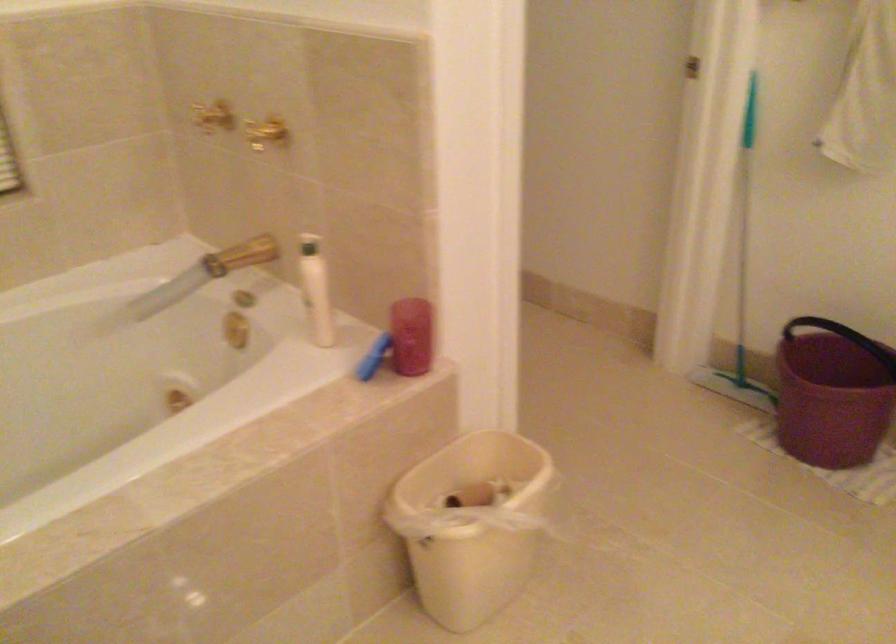
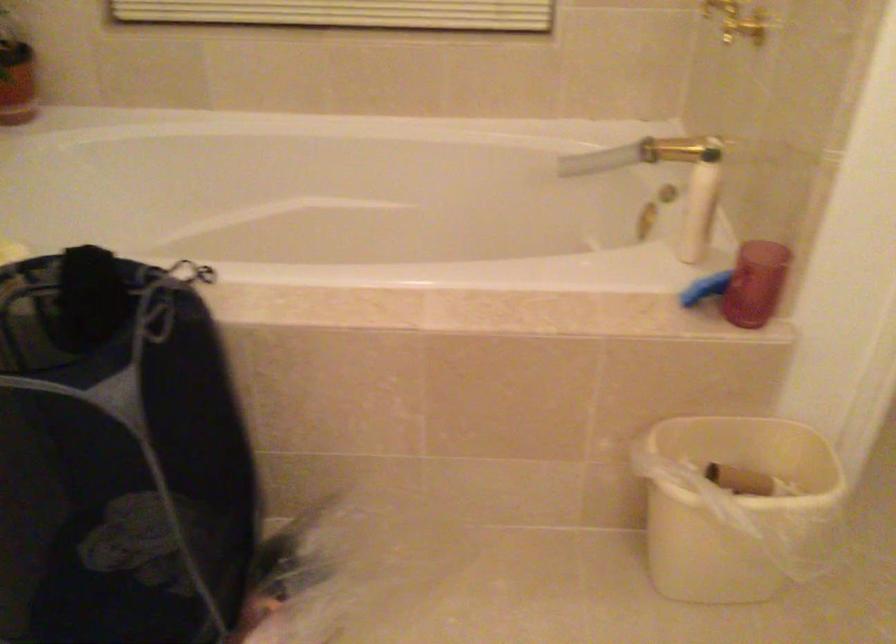
First-person continuous shooting, in which direction is the camera rotating?

The camera rotated toward left-down.